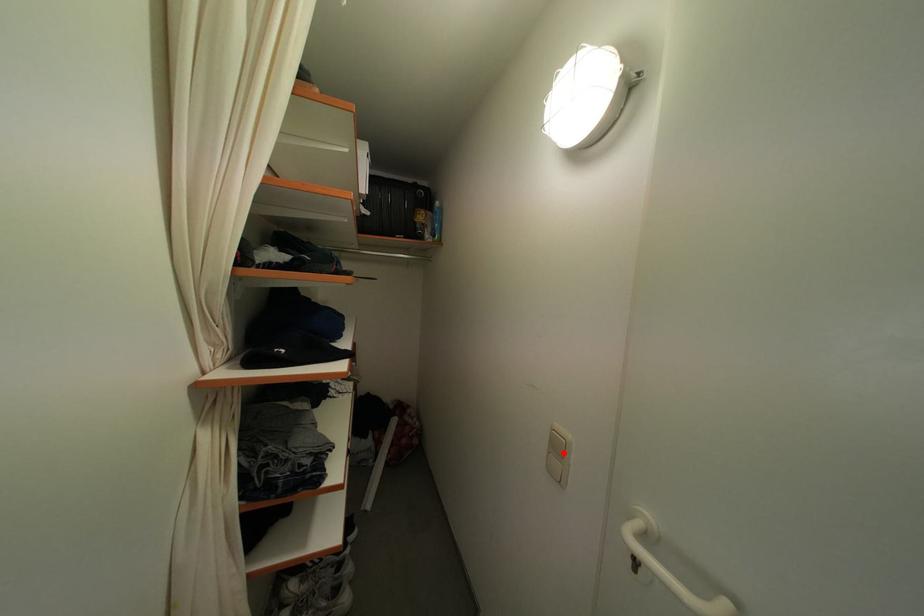
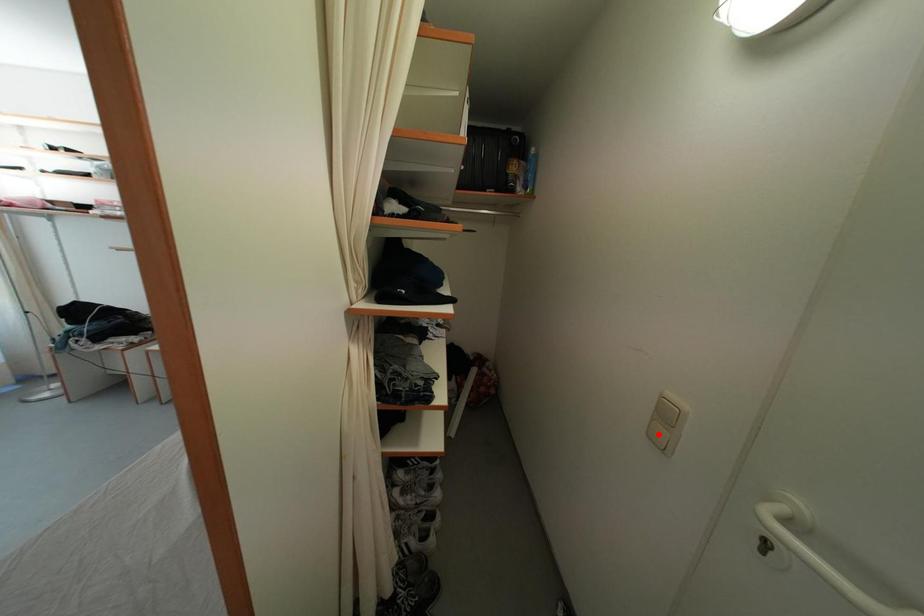
I am providing you with two images of the same scene from different viewpoints. A red point is marked on the first image and another point is marked on the second image. Do the highlighted points in image1 and image2 indicate the same real-world spot?

No